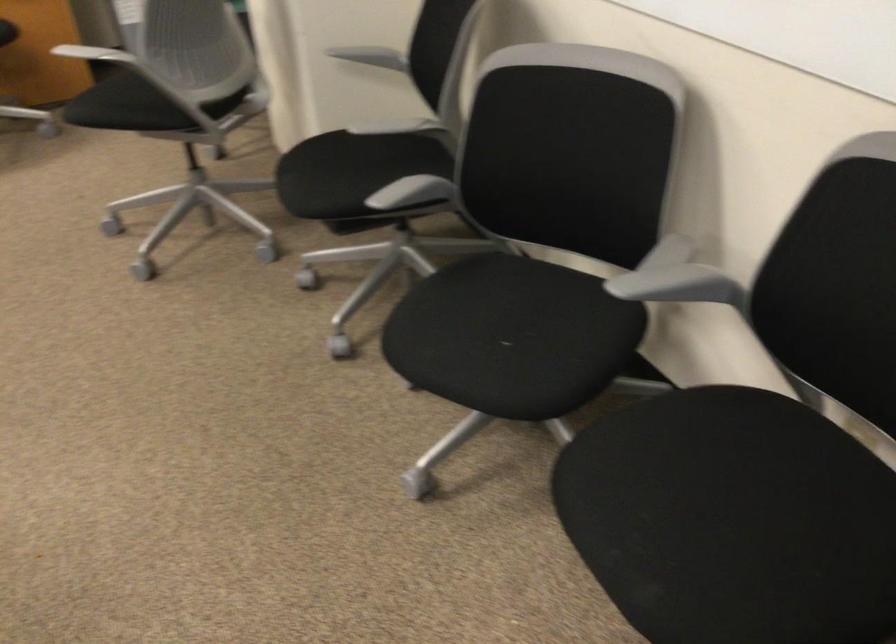
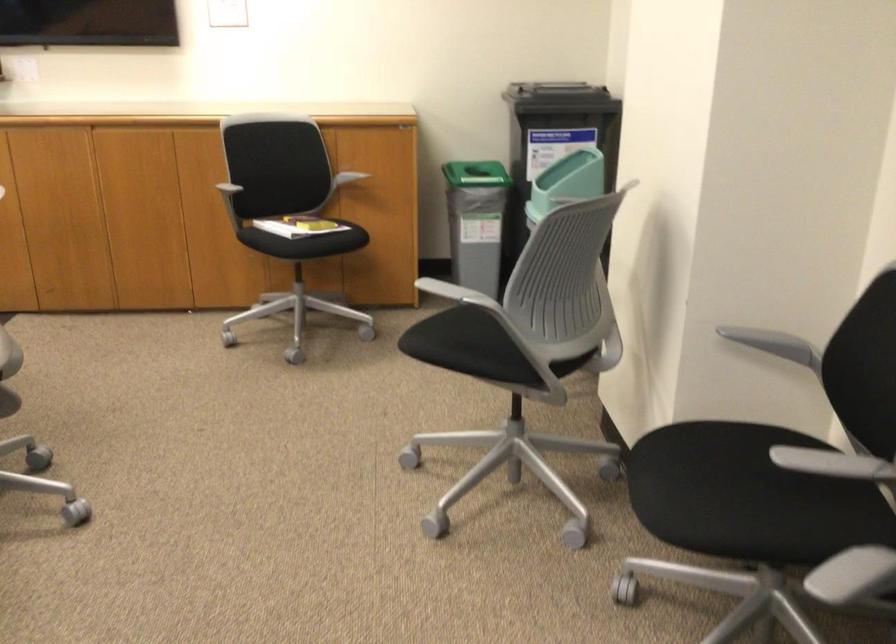
Question: The camera is either moving clockwise (left) or counter-clockwise (right) around the object. The first image is from the beginning of the video and the second image is from the end. Is the camera moving left or right when shooting the video?

Choices:
 (A) Left
 (B) Right

Answer: (B)